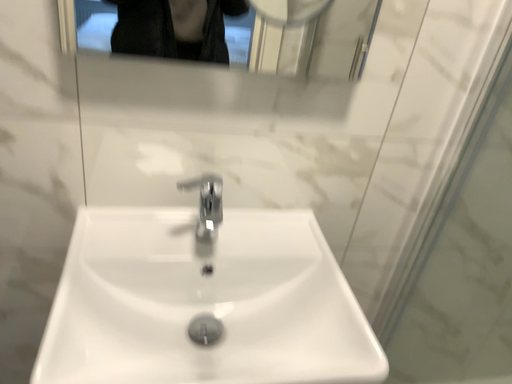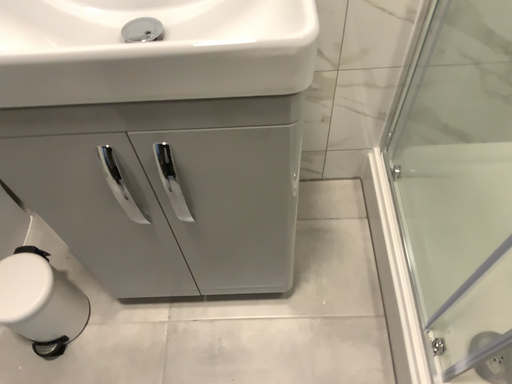
Question: Which way did the camera rotate in the video?

Choices:
 (A) rotated right
 (B) rotated left

Answer: (B)